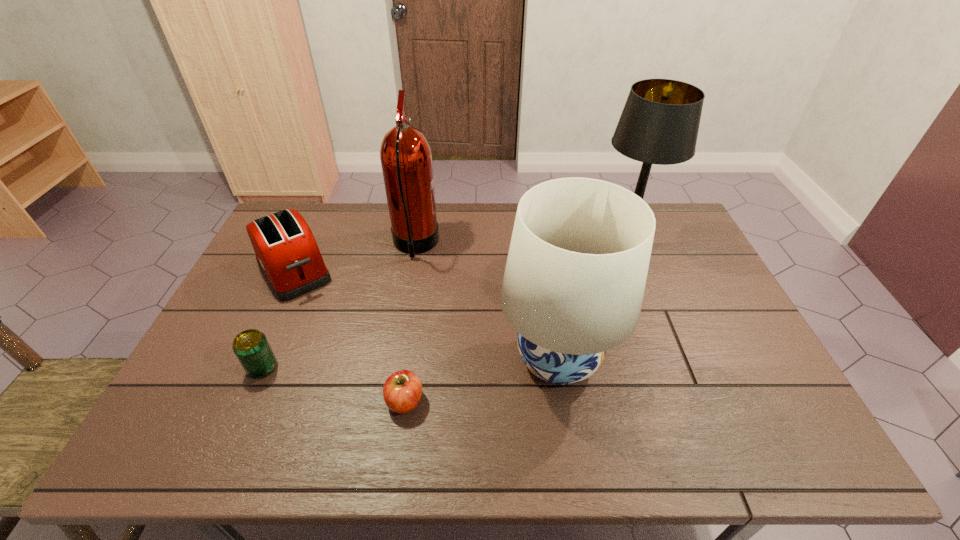
Locate an element on the screen. The image size is (960, 540). the rightmost object is located at coordinates (659, 124).

In order to click on fire extinguisher in this screenshot , I will do `click(406, 159)`.

Find the location of a particular element. The image size is (960, 540). the second object from right to left is located at coordinates (573, 286).

You are a GUI agent. You are given a task and a screenshot of the screen. Output one action in this format:
    pyautogui.click(x=<x>, y=<y>)
    Task: Click on the fourth tallest object
    The width and height of the screenshot is (960, 540).
    Given the screenshot: What is the action you would take?
    pyautogui.click(x=286, y=251)

Locate an element on the screen. The image size is (960, 540). the second shortest object is located at coordinates (251, 347).

The height and width of the screenshot is (540, 960). I want to click on the shortest object, so click(x=402, y=391).

At what (x,y) coordinates should I click in order to perform the action: click on free space located 0.360m on the front of the rightmost object. Please return your answer as a coordinate pair (x, y). The image size is (960, 540). Looking at the image, I should click on (668, 360).

Where is `free spot located on the front-facing side of the fire extinguisher`? This screenshot has height=540, width=960. free spot located on the front-facing side of the fire extinguisher is located at coordinates (456, 246).

The width and height of the screenshot is (960, 540). I want to click on vacant space situated 0.190m on the front-facing side of the second object from right to left, so point(425,359).

Identify the location of vacant space located on the front-facing side of the second object from right to left. (376, 359).